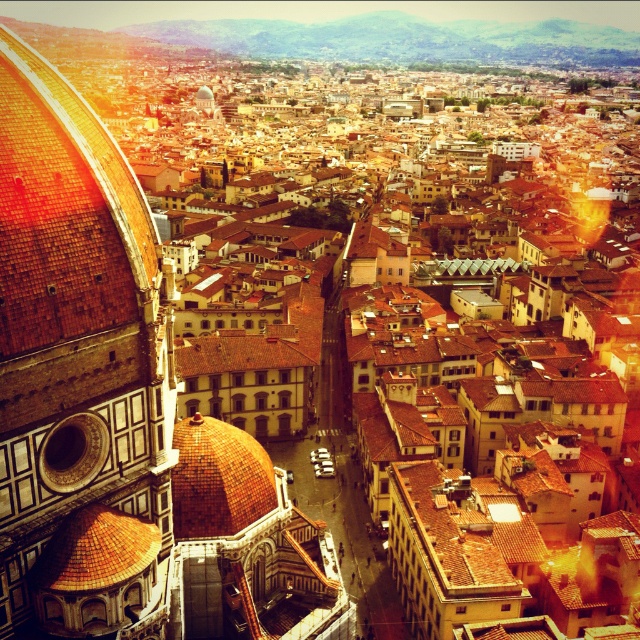
You are standing in the historic center of Florence, Italy, and you see the brown tiled dome at left and the golden mosaic dome at center. Which dome is positioned higher in the sky compared to the other?

The brown tiled dome at left is positioned higher in the sky than the golden mosaic dome at center because it is described as being above it.